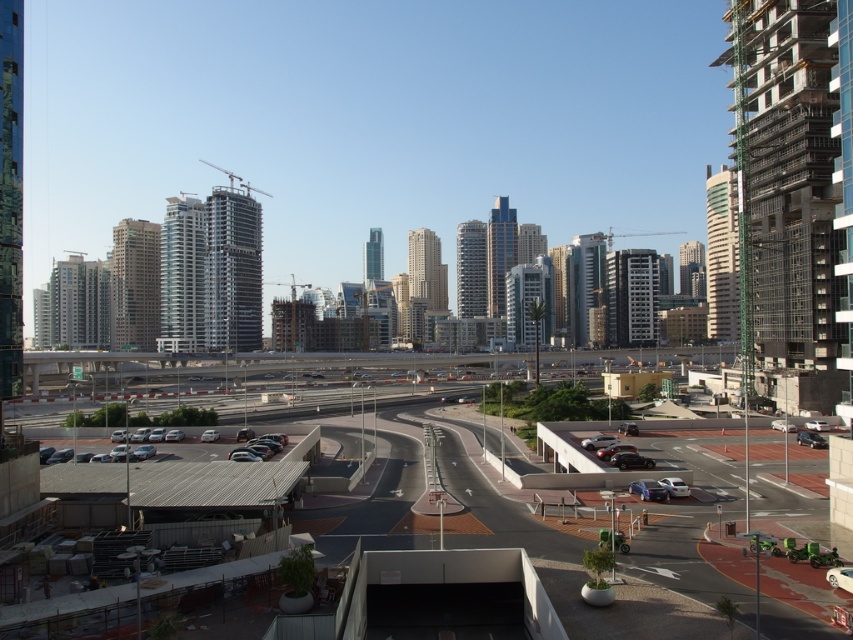
You are a delivery driver trying to park your white glossy sedan at lower right in the asphalt road at center. Can you fit your car into the parking space there?

The asphalt road at center has a larger size compared to the white glossy sedan at lower right, so yes, the car can fit into the parking space there.

You are a pedestrian standing at the curved road near the parking structure. You see the white glossy sedan at lower right and the shiny silver sedan at center. Which car is positioned more to the right side of the parking area?

The white glossy sedan at lower right is positioned more to the right side of the parking area because it is located to the right of the shiny silver sedan at center.